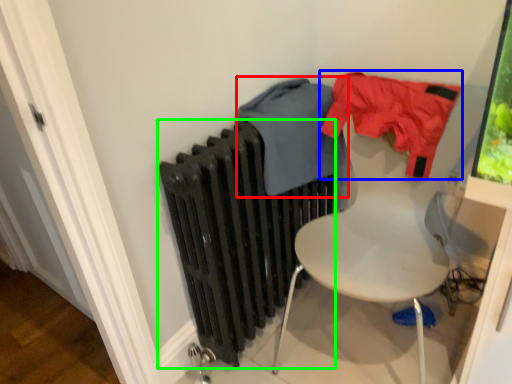
Question: Based on their relative distances, which object is nearer to clothing (highlighted by a red box)? Choose from clothing (highlighted by a blue box) and radiator (highlighted by a green box).

Choices:
 (A) clothing
 (B) radiator

Answer: (A)